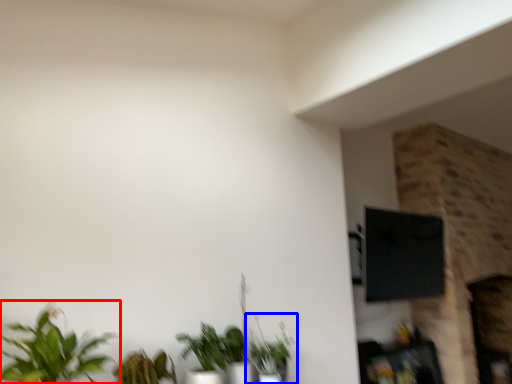
Question: Among these objects, which one is farthest to the camera, houseplant (highlighted by a red box) or houseplant (highlighted by a blue box)?

Choices:
 (A) houseplant
 (B) houseplant

Answer: (B)